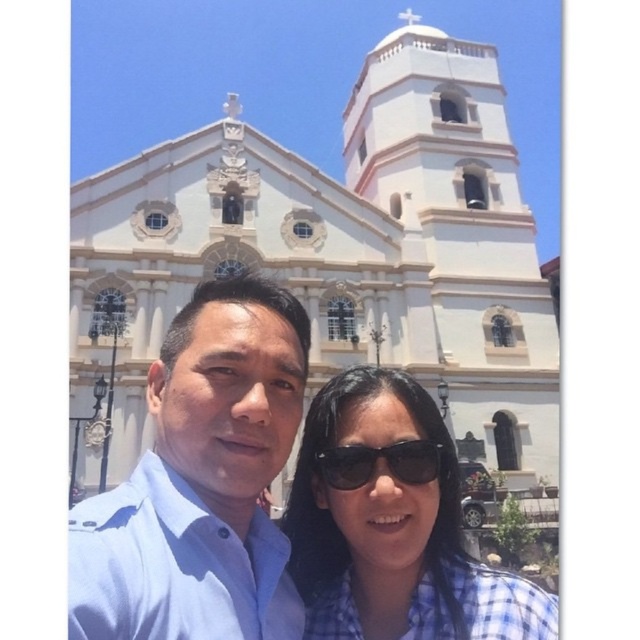
In the scene shown: You are a photographer trying to capture a photo of the two people in front of the church. The blue shirt at center and the black matte sunglasses at center are both in your frame. Which object should you focus on first if you want to ensure both are in focus?

The blue shirt at center is much taller than the black matte sunglasses at center, so you should focus on the blue shirt at center first to ensure both are in focus.

You are standing in front of the white stone church at center. If you want to take a photo of the bell tower, which direction should you look relative to the church?

The bell tower is part of the white stone church at center, so you should look towards the top of the church to capture the bell tower in your photo.